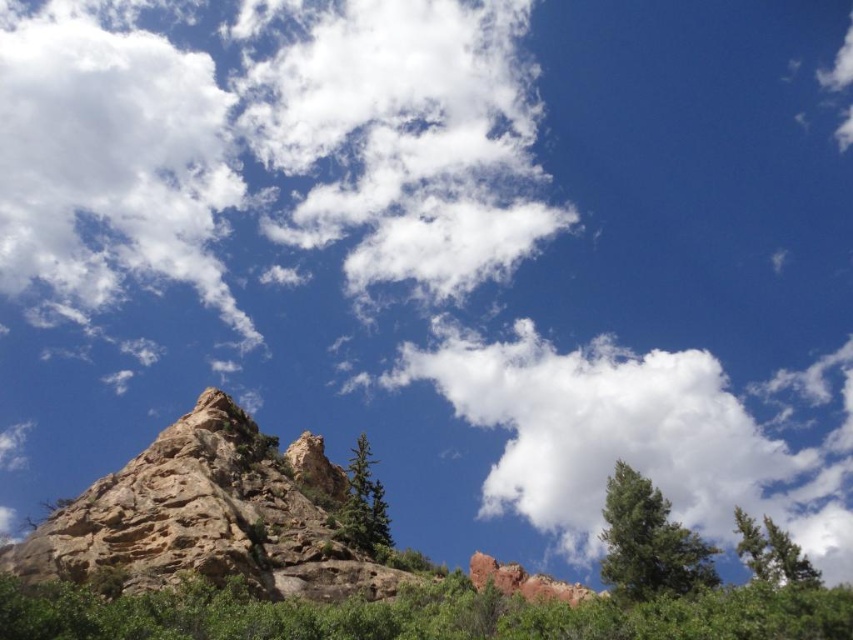
Identify the location of green textured tree at lower right. The height and width of the screenshot is (640, 853). (648, 541).

Consider the image. Does green textured tree at lower right have a greater width compared to green matte tree at center?

Correct, the width of green textured tree at lower right exceeds that of green matte tree at center.

Where is `green textured tree at lower right`? The width and height of the screenshot is (853, 640). green textured tree at lower right is located at coordinates (648, 541).

Who is shorter, rugged stone mountain at center or green matte tree at center?

green matte tree at center

Does rugged stone mountain at center appear over green matte tree at center?

Correct, rugged stone mountain at center is located above green matte tree at center.

Who is more forward, (158,561) or (341,513)?

Point (158,561)

The image size is (853, 640). Identify the location of rugged stone mountain at center. (209, 516).

Find the location of `rugged stone mountain at center`. rugged stone mountain at center is located at coordinates (209, 516).

The width and height of the screenshot is (853, 640). I want to click on rugged stone mountain at center, so click(x=209, y=516).